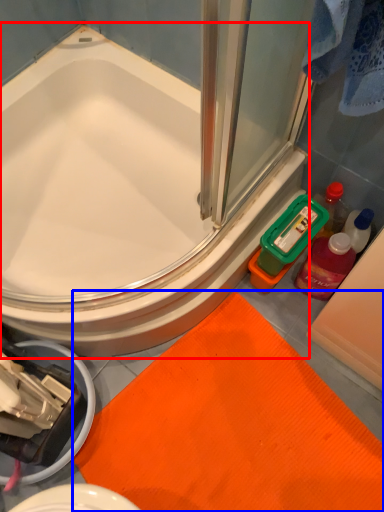
Question: Which object is further to the camera taking this photo, bathtub (highlighted by a red box) or bath mat (highlighted by a blue box)?

Choices:
 (A) bathtub
 (B) bath mat

Answer: (B)